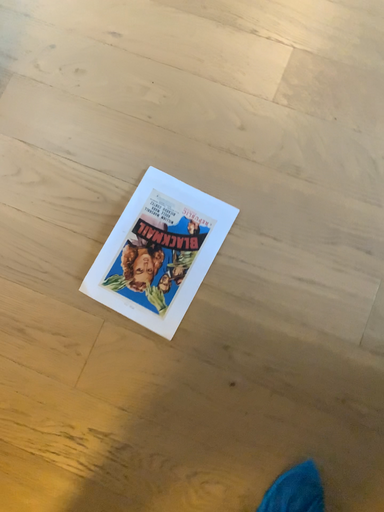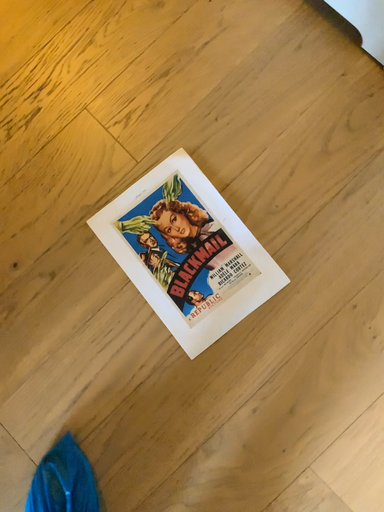
Question: Which way did the camera rotate in the video?

Choices:
 (A) rotated upward
 (B) rotated downward

Answer: (A)